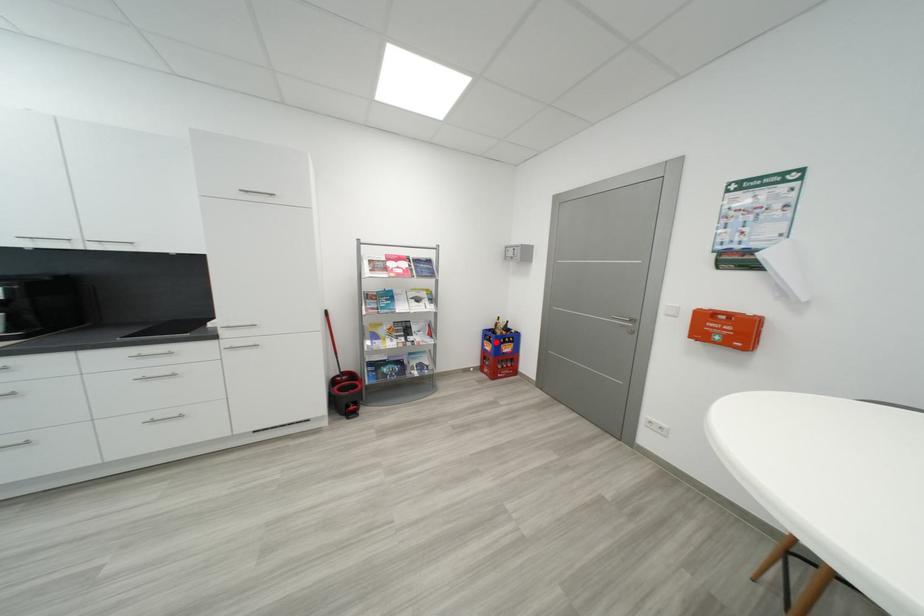
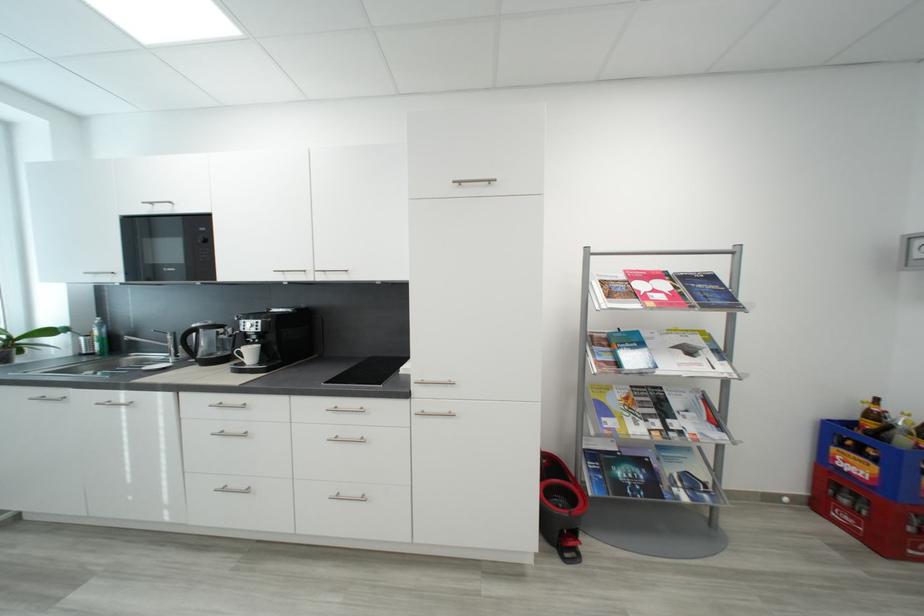
Question: I am providing you with two images of the same scene from different viewpoints. Image1 has a red point marked. In image2, the corresponding 3D location appears at what relative position? Reply with the corresponding letter.

Choices:
 (A) Closer
 (B) Farther

Answer: (A)